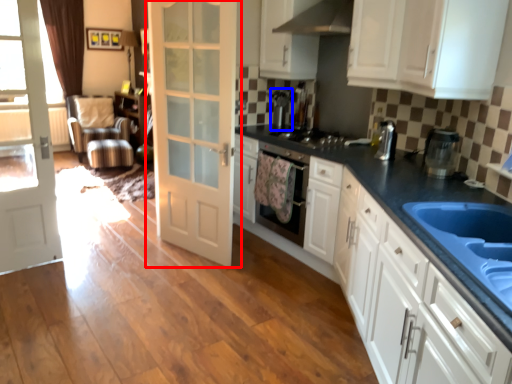
Question: Which object appears farthest to the camera in this image, door (highlighted by a red box) or coffee machine (highlighted by a blue box)?

Choices:
 (A) door
 (B) coffee machine

Answer: (B)